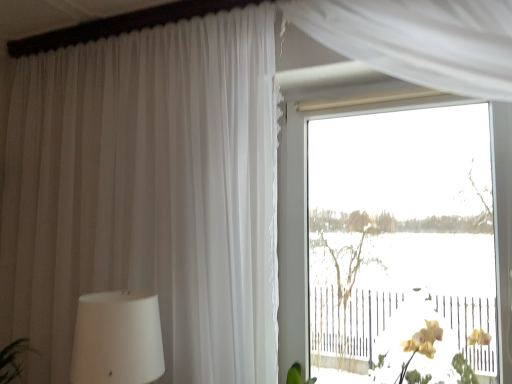
The width and height of the screenshot is (512, 384). Find the location of `metallic silver rail at lower right`. metallic silver rail at lower right is located at coordinates tap(350, 320).

What do you see at coordinates (350, 320) in the screenshot? I see `metallic silver rail at lower right` at bounding box center [350, 320].

At what (x,y) coordinates should I click in order to perform the action: click on transparent glass window at center. Please return your answer as a coordinate pair (x, y). The height and width of the screenshot is (384, 512). Looking at the image, I should click on (306, 218).

What do you see at coordinates (306, 218) in the screenshot? This screenshot has width=512, height=384. I see `transparent glass window at center` at bounding box center [306, 218].

Find the location of `metallic silver rail at lower right`. metallic silver rail at lower right is located at coordinates (350, 320).

From the picture: Between metallic silver rail at lower right and transparent glass window at center, which one appears on the right side from the viewer's perspective?

metallic silver rail at lower right.

Consider the image. Which object is closer to the camera taking this photo, metallic silver rail at lower right or transparent glass window at center?

metallic silver rail at lower right.

Which point is more forward, (320, 335) or (504, 280)?

Positioned in front is point (504, 280).

From the image's perspective, is metallic silver rail at lower right below transparent glass window at center?

Yes.

From a real-world perspective, between metallic silver rail at lower right and transparent glass window at center, who is vertically higher?

From a 3D spatial view, transparent glass window at center is above.

Considering the sizes of objects metallic silver rail at lower right and transparent glass window at center in the image provided, who is thinner, metallic silver rail at lower right or transparent glass window at center?

transparent glass window at center is thinner.

Is metallic silver rail at lower right taller than transparent glass window at center?

No.

Based on their sizes in the image, would you say metallic silver rail at lower right is bigger or smaller than transparent glass window at center?

A: In the image, metallic silver rail at lower right appears to be smaller than transparent glass window at center.

Would you say transparent glass window at center is part of metallic silver rail at lower right's contents?

No, transparent glass window at center is not a part of metallic silver rail at lower right.

Is metallic silver rail at lower right positioned far away from transparent glass window at center?

They are positioned close to each other.

Does metallic silver rail at lower right turn towards transparent glass window at center?

No.

Consider the image. What's the angular difference between metallic silver rail at lower right and transparent glass window at center's facing directions?

The facing directions of metallic silver rail at lower right and transparent glass window at center are 3.7e-05 degrees apart.

This screenshot has width=512, height=384. I want to click on rail that appears below the transparent glass window at center (from the image's perspective), so click(350, 320).

Considering the positions of objects transparent glass window at center and metallic silver rail at lower right in the image provided, who is more to the left, transparent glass window at center or metallic silver rail at lower right?

transparent glass window at center.

Is the depth of transparent glass window at center greater than that of metallic silver rail at lower right?

Yes, it is behind metallic silver rail at lower right.

Which point is more forward, (281, 121) or (464, 327)?

The point (464, 327) is closer to the camera.

From the image's perspective, is transparent glass window at center above or below metallic silver rail at lower right?

transparent glass window at center is situated higher than metallic silver rail at lower right in the image.

From a real-world perspective, does transparent glass window at center sit lower than metallic silver rail at lower right?

No, from a real-world perspective, transparent glass window at center is not below metallic silver rail at lower right.

Which of these two, transparent glass window at center or metallic silver rail at lower right, is thinner?

transparent glass window at center is thinner.

From the picture: Considering the sizes of objects transparent glass window at center and metallic silver rail at lower right in the image provided, who is taller, transparent glass window at center or metallic silver rail at lower right?

transparent glass window at center.

Considering the relative sizes of transparent glass window at center and metallic silver rail at lower right in the image provided, is transparent glass window at center bigger than metallic silver rail at lower right?

Yes.

Is transparent glass window at center surrounding metallic silver rail at lower right?

No, metallic silver rail at lower right is not a part of transparent glass window at center.

Is transparent glass window at center with metallic silver rail at lower right?

No.

Is transparent glass window at center positioned with its back to metallic silver rail at lower right?

Absolutely, transparent glass window at center is directed away from metallic silver rail at lower right.

Locate an element on the screen. rail lying in front of the transparent glass window at center is located at coordinates (350, 320).

Locate an element on the screen. window that is on the left side of metallic silver rail at lower right is located at coordinates (306, 218).

Find the location of a particular element. rail located in front of the transparent glass window at center is located at coordinates (350, 320).